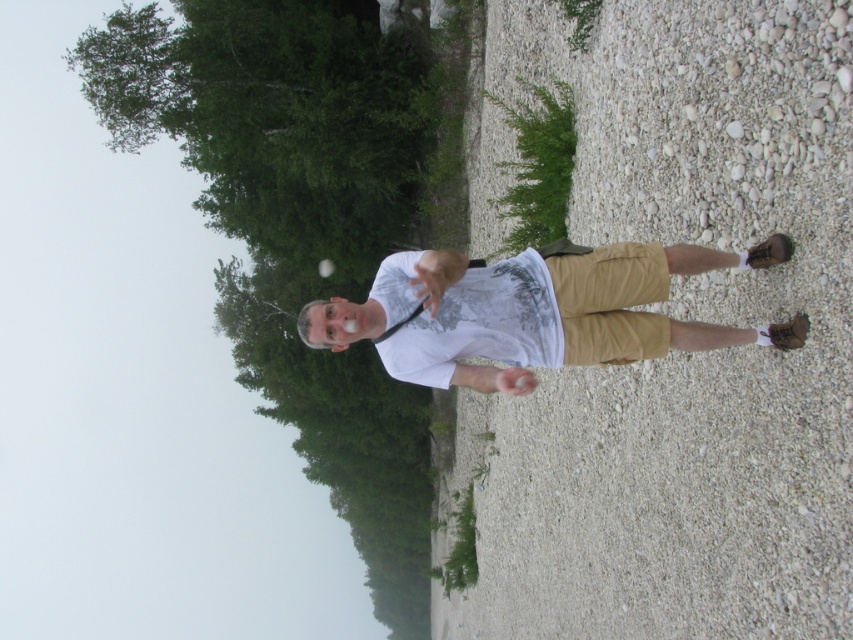
Question: Which point is closer to the camera taking this photo?

Choices:
 (A) (503, 65)
 (B) (659, 333)

Answer: (B)

Question: Is white gravel at center bigger than white matte shirt at center?

Choices:
 (A) yes
 (B) no

Answer: (A)

Question: Among these objects, which one is nearest to the camera?

Choices:
 (A) white matte shirt at center
 (B) white gravel at center

Answer: (B)

Question: Which point appears closest to the camera in this image?

Choices:
 (A) (846, 326)
 (B) (442, 259)

Answer: (A)

Question: Can you confirm if white gravel at center is thinner than white matte shirt at center?

Choices:
 (A) no
 (B) yes

Answer: (B)

Question: Can you confirm if white gravel at center is smaller than white matte shirt at center?

Choices:
 (A) no
 (B) yes

Answer: (A)